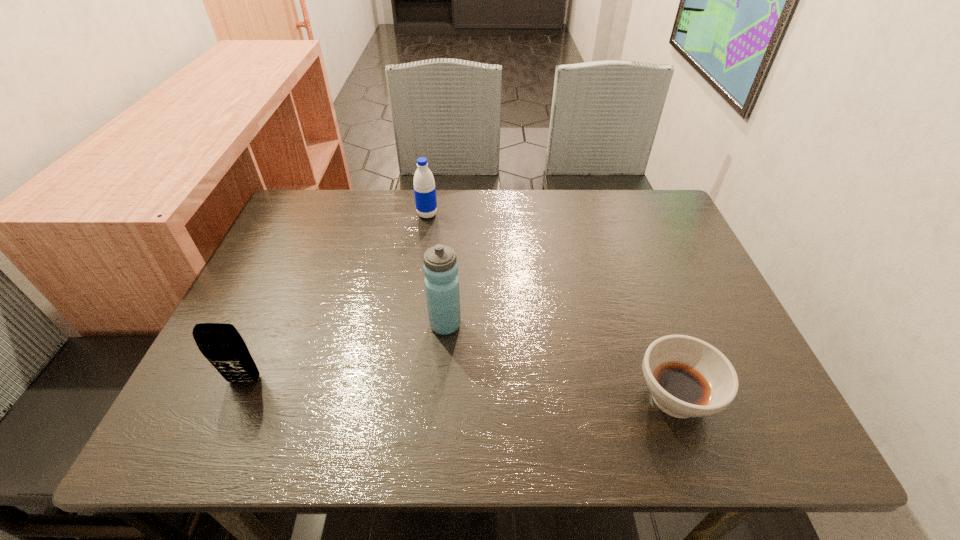
This screenshot has height=540, width=960. What are the coordinates of `the taller water bottle` in the screenshot? It's located at (440, 267).

You are a GUI agent. You are given a task and a screenshot of the screen. Output one action in this format:
    pyautogui.click(x=<x>, y=<y>)
    Task: Click on the tallest object
    
    Given the screenshot: What is the action you would take?
    pyautogui.click(x=440, y=267)

Locate an element on the screen. This screenshot has height=540, width=960. the farther water bottle is located at coordinates (424, 185).

At what (x,y) coordinates should I click in order to perform the action: click on the left water bottle. Please return your answer as a coordinate pair (x, y). Looking at the image, I should click on (424, 185).

The width and height of the screenshot is (960, 540). In order to click on cellular telephone in this screenshot , I will do tap(221, 344).

Locate an element on the screen. This screenshot has height=540, width=960. the shortest object is located at coordinates (687, 377).

Find the location of a particular element. soup bowl is located at coordinates (687, 377).

At what (x,y) coordinates should I click in order to perform the action: click on free point located 0.180m on the left of the taller water bottle. Please return your answer as a coordinate pair (x, y). This screenshot has width=960, height=540. Looking at the image, I should click on (349, 325).

Find the location of a particular element. This screenshot has width=960, height=540. vacant region located on the front of the shorter water bottle is located at coordinates (424, 236).

You are a GUI agent. You are given a task and a screenshot of the screen. Output one action in this format:
    pyautogui.click(x=<x>, y=<y>)
    Task: Click on the free region located on the screen of the cellular telephone
    The image size is (960, 540).
    Given the screenshot: What is the action you would take?
    [x=222, y=430]